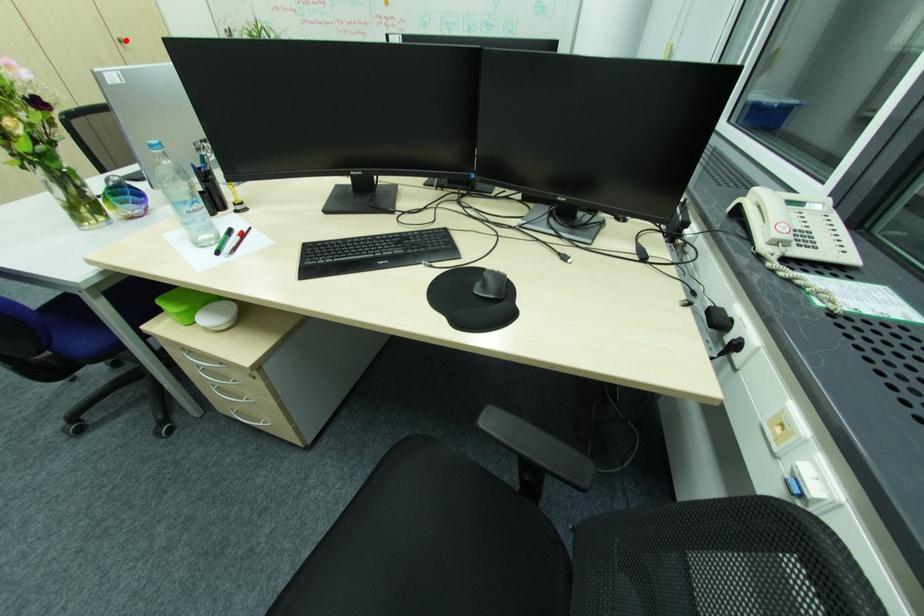
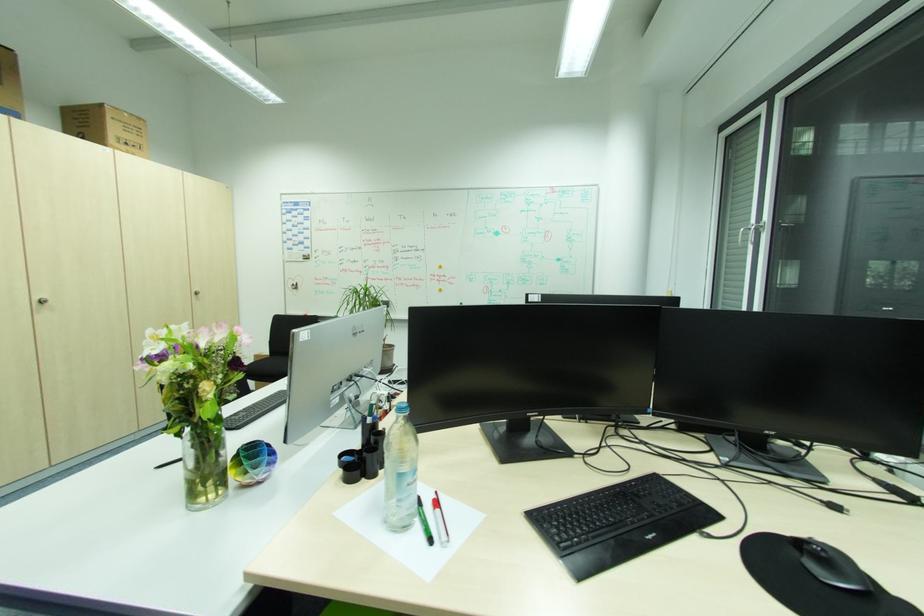
Find the pixel in the second image that matches the highlighted location in the first image.

(202, 293)